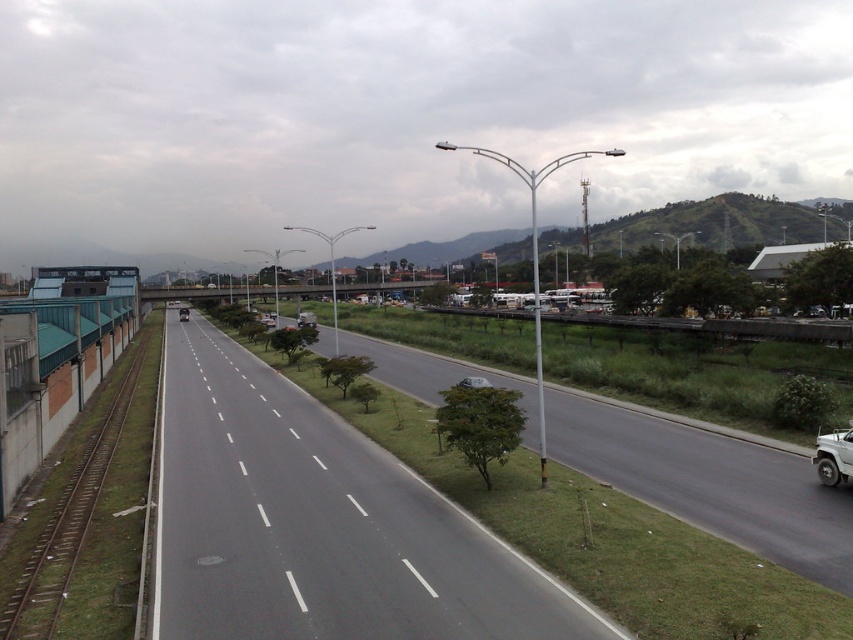
Does asphalt road at center appear on the right side of shiny black sedan at center?

Correct, you'll find asphalt road at center to the right of shiny black sedan at center.

Locate an element on the screen. Image resolution: width=853 pixels, height=640 pixels. asphalt road at center is located at coordinates (317, 524).

You are a GUI agent. You are given a task and a screenshot of the screen. Output one action in this format:
    pyautogui.click(x=<x>, y=<y>)
    Task: Click on the asphalt road at center
    The width and height of the screenshot is (853, 640).
    Given the screenshot: What is the action you would take?
    pyautogui.click(x=317, y=524)

Who is lower down, brown metal train track at left or shiny black sedan at center?

brown metal train track at left is lower down.

Which is behind, point (51, 621) or point (183, 312)?

The point (183, 312) is more distant.

Between point (74, 493) and point (180, 321), which one is positioned behind?

Positioned behind is point (180, 321).

Locate an element on the screen. The image size is (853, 640). brown metal train track at left is located at coordinates (86, 515).

Consider the image. Does asphalt road at center have a greater width compared to white glossy car at center?

Indeed, asphalt road at center has a greater width compared to white glossy car at center.

The image size is (853, 640). What do you see at coordinates (317, 524) in the screenshot?
I see `asphalt road at center` at bounding box center [317, 524].

You are a GUI agent. You are given a task and a screenshot of the screen. Output one action in this format:
    pyautogui.click(x=<x>, y=<y>)
    Task: Click on the asphalt road at center
    The image size is (853, 640).
    Given the screenshot: What is the action you would take?
    pyautogui.click(x=317, y=524)